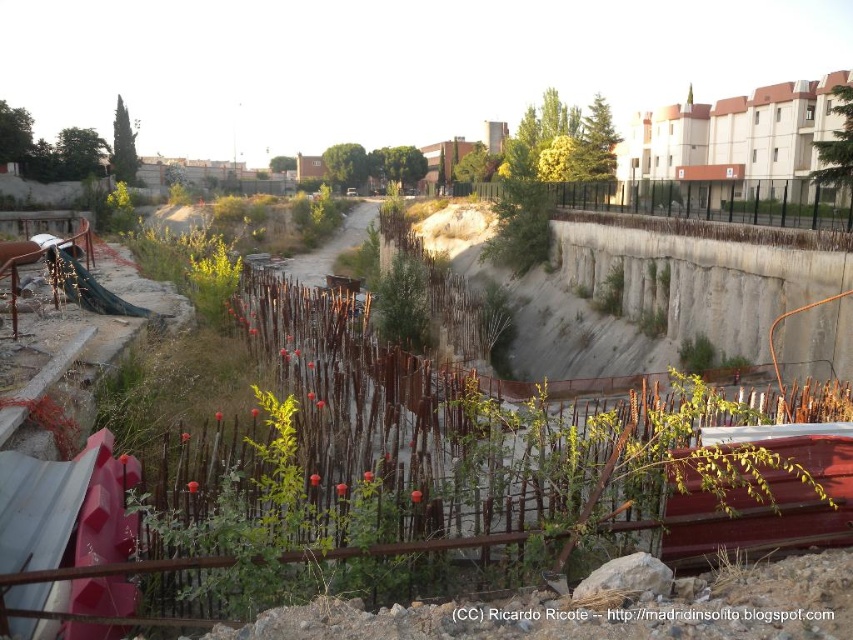
Question: Is smooth concrete hillside at center further to camera compared to rustic wooden boat at lower right?

Choices:
 (A) yes
 (B) no

Answer: (A)

Question: Does smooth concrete hillside at center appear on the right side of rustic wooden boat at lower right?

Choices:
 (A) yes
 (B) no

Answer: (B)

Question: Among these points, which one is nearest to the camera?

Choices:
 (A) (749, 509)
 (B) (569, 250)

Answer: (A)

Question: Which object is closer to the camera taking this photo?

Choices:
 (A) smooth concrete hillside at center
 (B) rustic wooden boat at lower right

Answer: (B)

Question: Does smooth concrete hillside at center appear under rustic wooden boat at lower right?

Choices:
 (A) no
 (B) yes

Answer: (A)